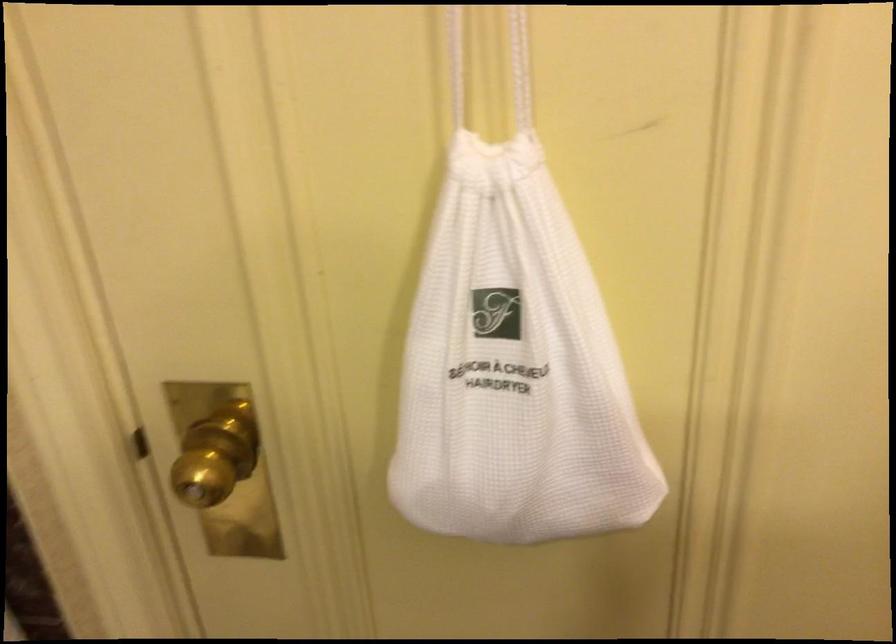
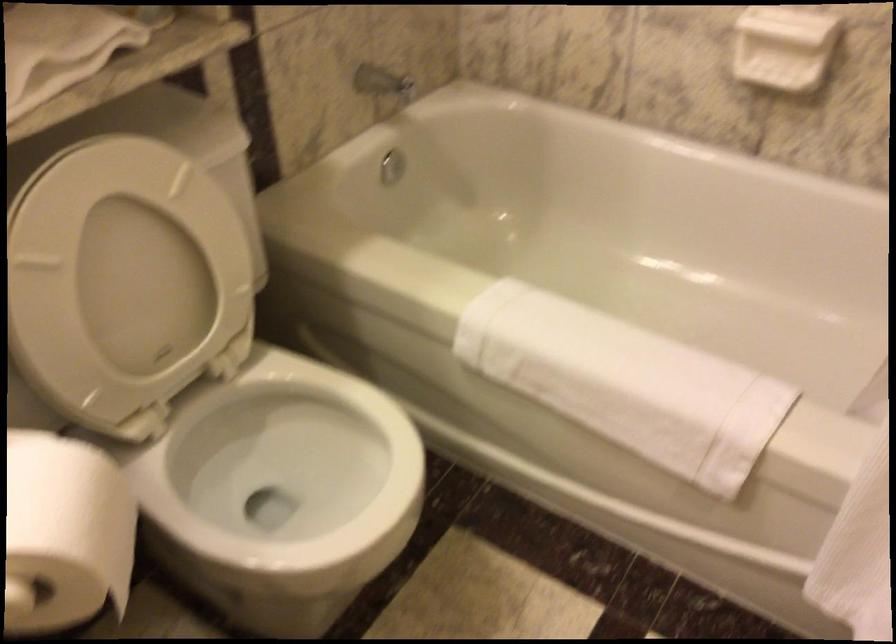
The first image is from the beginning of the video and the second image is from the end. How did the camera likely rotate when shooting the video?

The camera rotated toward left-down.